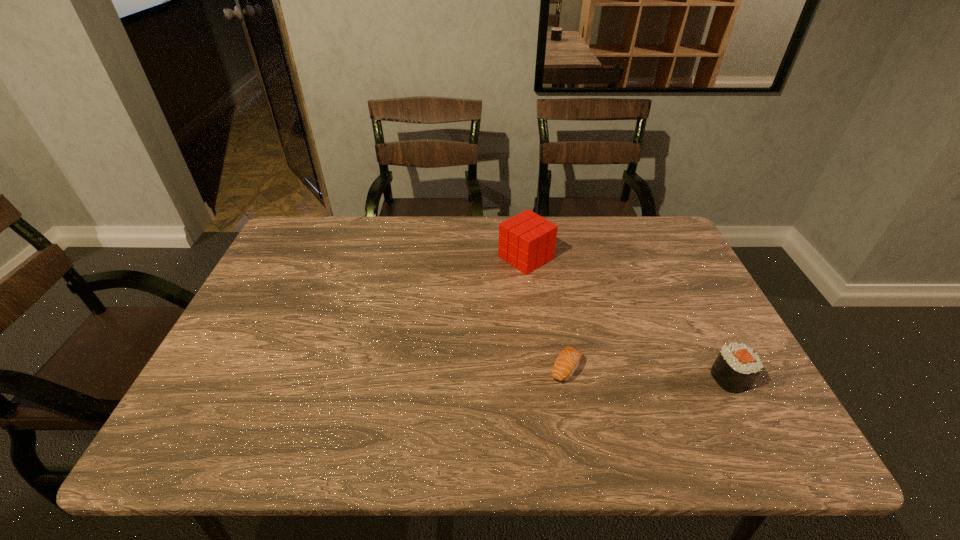
Locate an element on the screen. The width and height of the screenshot is (960, 540). the tallest object is located at coordinates (527, 241).

Find the location of a particular element. cube is located at coordinates (527, 241).

Identify the location of the second tallest object. Image resolution: width=960 pixels, height=540 pixels. (737, 366).

Image resolution: width=960 pixels, height=540 pixels. In order to click on the right sushi in this screenshot , I will do `click(737, 366)`.

The image size is (960, 540). In order to click on the shorter sushi in this screenshot , I will do `click(567, 361)`.

You are a GUI agent. You are given a task and a screenshot of the screen. Output one action in this format:
    pyautogui.click(x=<x>, y=<y>)
    Task: Click on the left sushi
    
    Given the screenshot: What is the action you would take?
    pyautogui.click(x=567, y=361)

The width and height of the screenshot is (960, 540). I want to click on free point located on the left of the cube, so click(x=385, y=258).

Locate an element on the screen. The height and width of the screenshot is (540, 960). vacant space located on the left of the rightmost object is located at coordinates (662, 378).

Locate an element on the screen. vacant space located on the back of the shortest object is located at coordinates (559, 333).

Where is `object that is at the far edge`? The width and height of the screenshot is (960, 540). object that is at the far edge is located at coordinates click(527, 241).